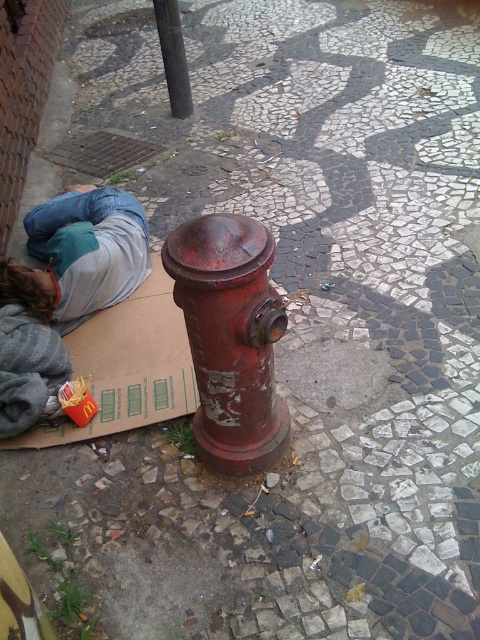
Question: Which point is closer to the camera taking this photo?

Choices:
 (A) (132, 256)
 (B) (170, 38)
 (C) (271, 401)

Answer: (C)

Question: Which is nearer to the denim jacket at lower left?

Choices:
 (A) smooth black pole at upper center
 (B) cardboard box at lower left
 (C) rusty metal hydrant at center

Answer: (B)

Question: In this image, where is cardboard box at lower left located relative to denim jacket at lower left?

Choices:
 (A) left
 (B) right

Answer: (B)

Question: Can you confirm if cardboard box at lower left is positioned below denim jacket at lower left?

Choices:
 (A) no
 (B) yes

Answer: (B)

Question: Which object is closer to the camera taking this photo?

Choices:
 (A) rusty metal hydrant at center
 (B) denim jacket at lower left

Answer: (A)

Question: Is rusty metal hydrant at center positioned before smooth black pole at upper center?

Choices:
 (A) no
 (B) yes

Answer: (B)